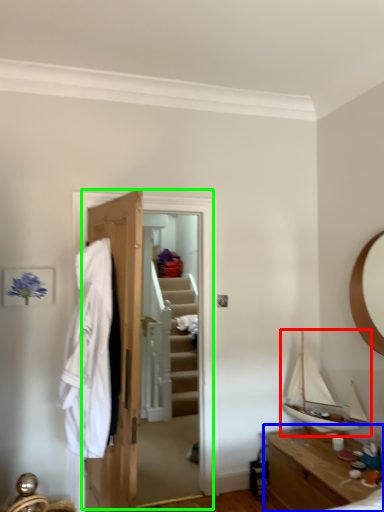
Question: Considering the real-world distances, which object is closest to boat (highlighted by a red box)? table (highlighted by a blue box) or closet (highlighted by a green box).

Choices:
 (A) table
 (B) closet

Answer: (A)